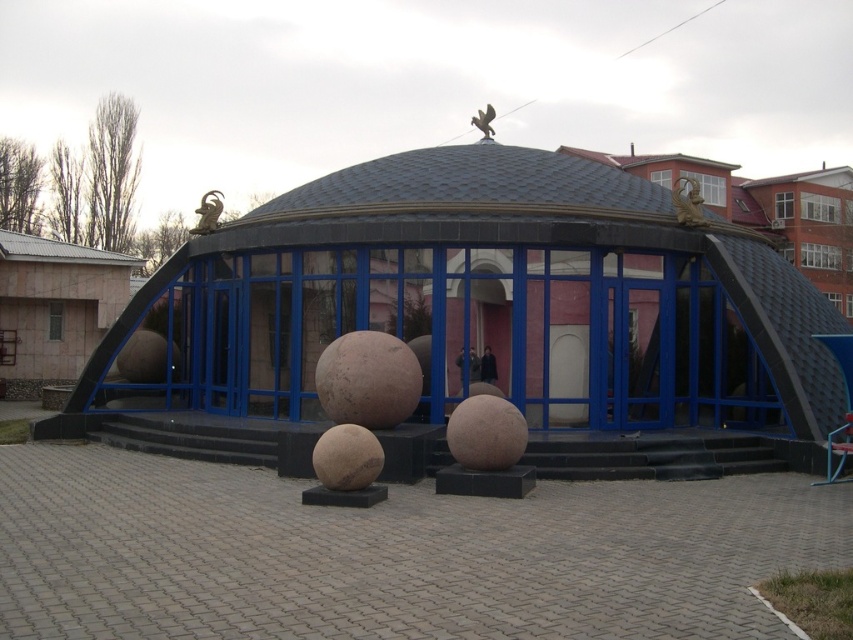
You are standing at the entrance of the building and want to take a photo of the gold metallic ram at upper center. Where should you position yourself to capture it in the frame?

To capture the gold metallic ram at upper center in the frame, position yourself at the entrance and look towards the upper center area, as that is where the gold metallic ram at upper center is located according to the coordinates provided.

You are standing at the entrance of the modern building and want to take a photo of the point marked at coordinates (595, 211). If your camera has a focal length of 50mm and you are 15.74 meters away from the point, what is the approximate angle of view needed to capture the entire scene around that point in your photo?

The angle of view required to capture the entire scene around the point marked at coordinates (595, 211) would depend on the camera sensor size and the focal length. However, with a 50mm lens and a distance of 15.74 meters, a standard angle of view of around 46 degrees is typical for full frame sensors, which should adequately capture the area around the point.